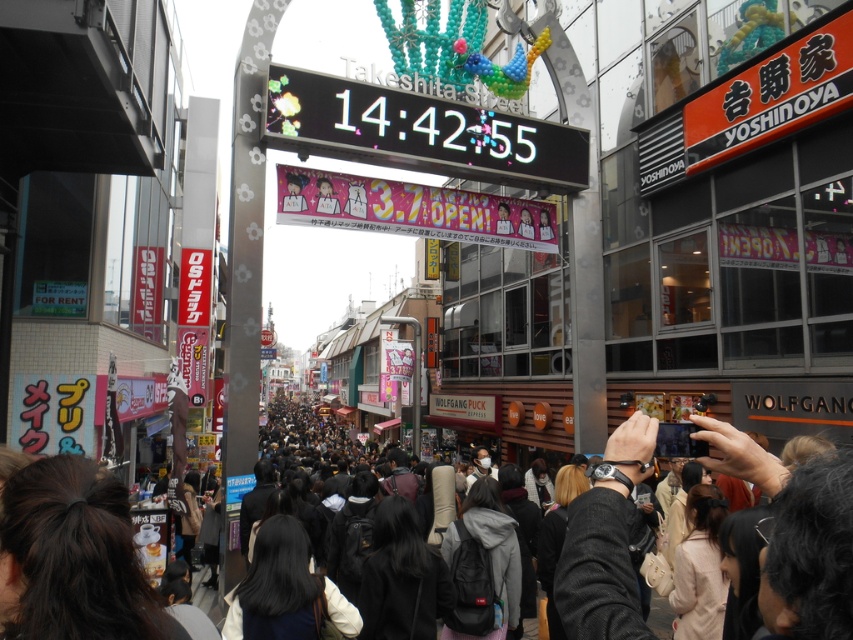
Question: Which object is closer to the camera taking this photo?

Choices:
 (A) dark brown hair at lower left
 (B) pink glossy banner at center

Answer: (A)

Question: Can you confirm if black fabric camera at center is thinner than black matte hair at center?

Choices:
 (A) no
 (B) yes

Answer: (A)

Question: Can you confirm if black fabric camera at center is thinner than dark brown hair at lower left?

Choices:
 (A) no
 (B) yes

Answer: (A)

Question: Which of the following is the farthest from the observer?

Choices:
 (A) (477, 227)
 (B) (393, 611)

Answer: (A)

Question: Does pink glossy banner at center appear on the right side of black matte hair at center?

Choices:
 (A) yes
 (B) no

Answer: (A)

Question: Estimate the real-world distances between objects in this image. Which object is farther from the black hair at center?

Choices:
 (A) black matte backpack at center
 (B) black fabric camera at center
 (C) pink glossy banner at center
 (D) black matte hair at center

Answer: (C)